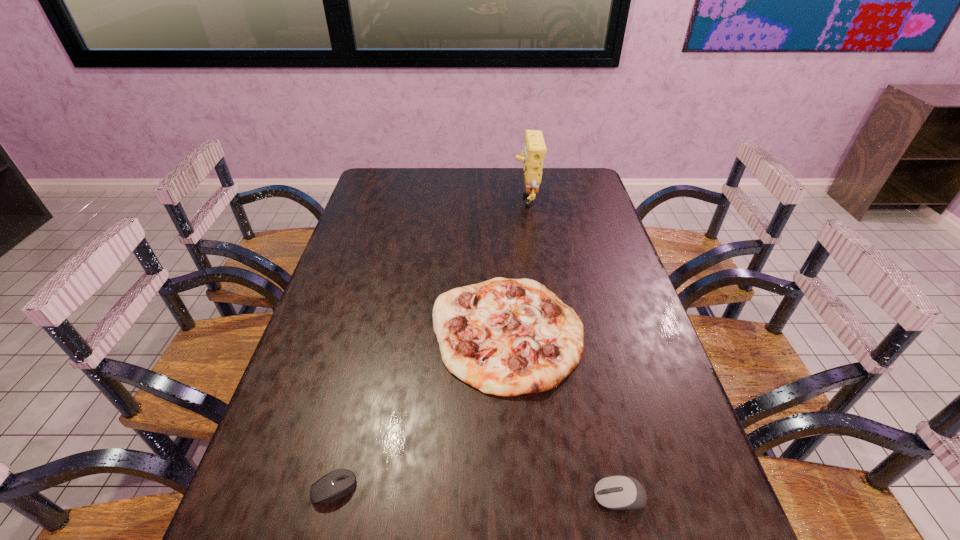
Locate an element on the screen. The image size is (960, 540). vacant space at the left edge of the desktop is located at coordinates (332, 343).

Where is `vacant area at the right edge`? The height and width of the screenshot is (540, 960). vacant area at the right edge is located at coordinates (605, 369).

What are the coordinates of `free spot at the far left corner of the desktop` in the screenshot? It's located at (384, 170).

Image resolution: width=960 pixels, height=540 pixels. Find the location of `free space between the second farthest object and the tallest object`. free space between the second farthest object and the tallest object is located at coordinates (516, 265).

Where is `unoccupied area between the shorter computer equipment and the tallest object`? The height and width of the screenshot is (540, 960). unoccupied area between the shorter computer equipment and the tallest object is located at coordinates (429, 343).

Find the location of a particular element. free spot between the shorter computer equipment and the second farthest object is located at coordinates (420, 410).

Find the location of a particular element. The image size is (960, 540). free space between the second shortest object and the second farthest object is located at coordinates (564, 415).

You are a GUI agent. You are given a task and a screenshot of the screen. Output one action in this format:
    pyautogui.click(x=<x>, y=<y>)
    Task: Click on the unoccupied position between the sponge and the shortest object
    The image size is (960, 540).
    Given the screenshot: What is the action you would take?
    pyautogui.click(x=429, y=343)

Locate an element on the screen. blank region between the shortest object and the tallest object is located at coordinates (429, 343).

Where is `vacant area that lies between the left computer equipment and the pizza`? This screenshot has width=960, height=540. vacant area that lies between the left computer equipment and the pizza is located at coordinates (420, 410).